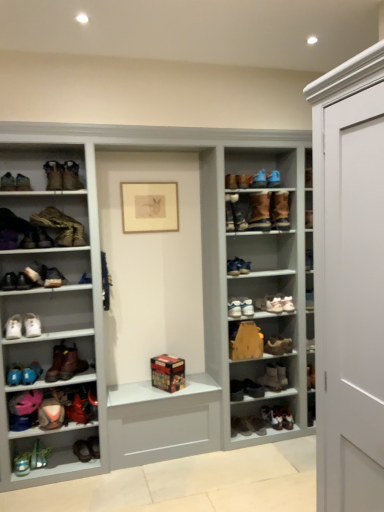
The image size is (384, 512). What are the coordinates of `free spot in front of leather boot at lower left, placed as the nineteenth footwear when sorted from top to bottom` in the screenshot? It's located at (79, 469).